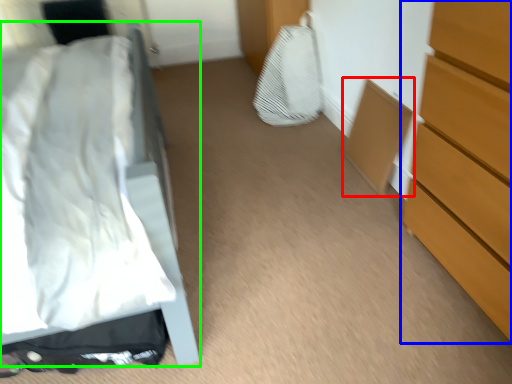
Question: Estimate the real-world distances between objects in this image. Which object is farther from cabinetry (highlighted by a red box), chest of drawers (highlighted by a blue box) or bed (highlighted by a green box)?

Choices:
 (A) chest of drawers
 (B) bed

Answer: (B)